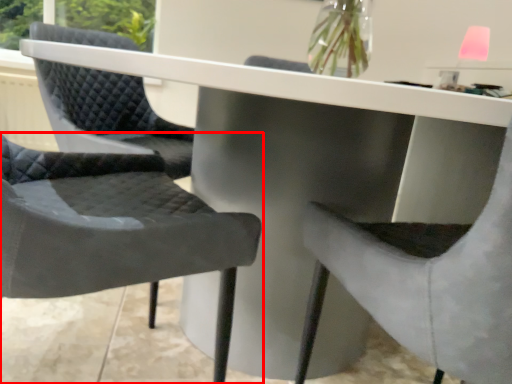
Question: From the image's perspective, where is chair (annotated by the red box) located in relation to chair in the image?

Choices:
 (A) below
 (B) above

Answer: (B)